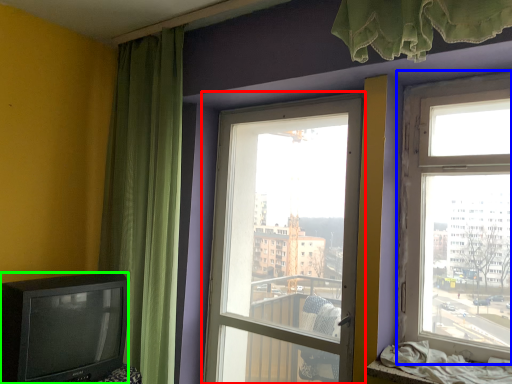
Question: Which is farther away from window (highlighted by a red box)? window (highlighted by a blue box) or television (highlighted by a green box)?

Choices:
 (A) window
 (B) television

Answer: (B)